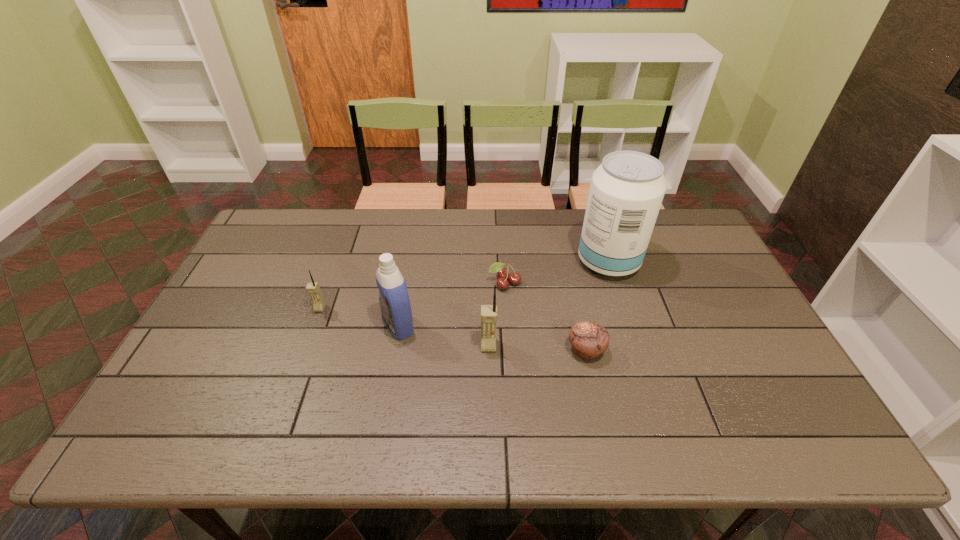
Please show where to add a cellular telephone on the right while keeping spacing even. Please provide its 2D coordinates. Your answer should be formatted as a tuple, i.e. [(x, y)], where the tuple contains the x and y coordinates of a point satisfying the conditions above.

[(687, 389)]